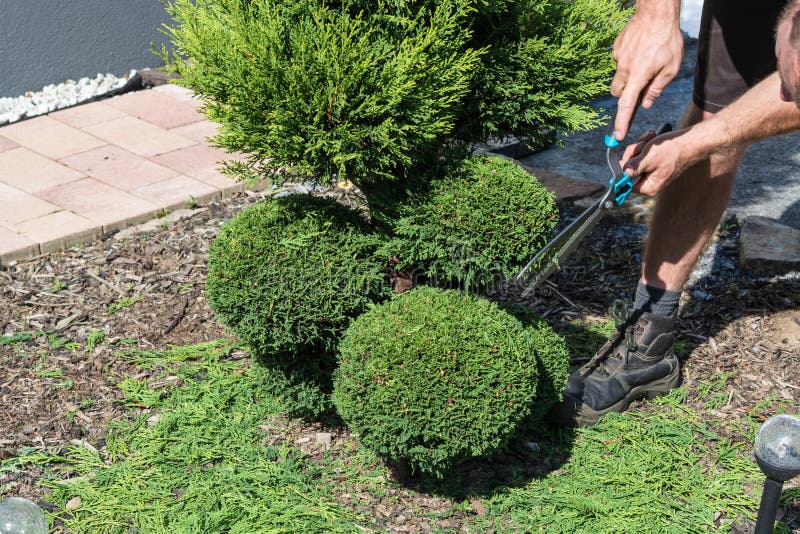
Locate an element on the screen. The image size is (800, 534). sock is located at coordinates [653, 292].